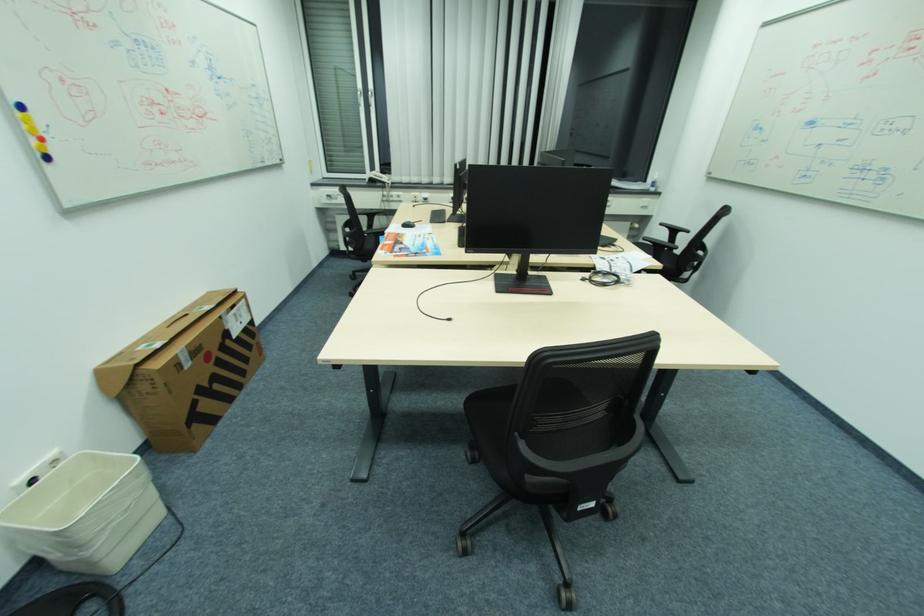
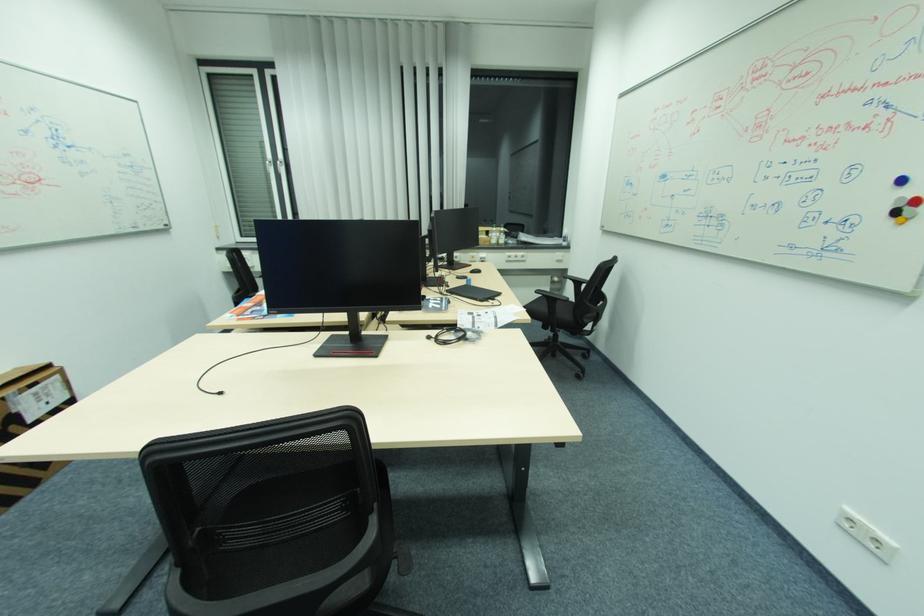
Find the pixel in the second image that matches (477,252) in the first image.

(282, 312)